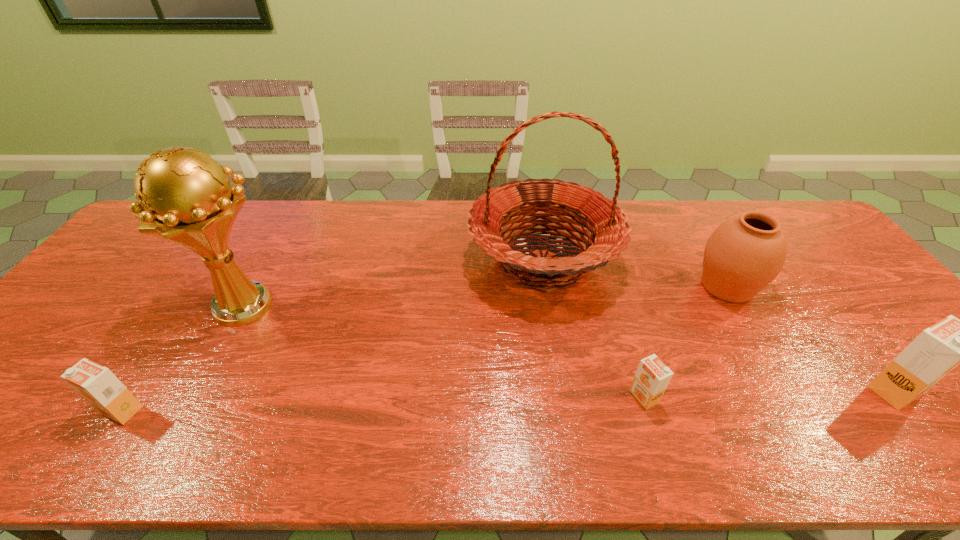
Find the location of a particular element. free point that satisfies the following two spatial constraints: 1. at the front of the second orange juice from right to left where the globe is prominent; 2. on the right side of the trophy_cup is located at coordinates (198, 396).

I want to click on free space that satisfies the following two spatial constraints: 1. on the front side of the urn; 2. on the right side of the rightmost orange juice, so click(788, 390).

You are a GUI agent. You are given a task and a screenshot of the screen. Output one action in this format:
    pyautogui.click(x=<x>, y=<y>)
    Task: Click on the vacant space that satisfies the following two spatial constraints: 1. at the front of the trophy_cup where the globe is prominent; 2. on the right side of the rightmost object
    This screenshot has height=540, width=960.
    Given the screenshot: What is the action you would take?
    pyautogui.click(x=201, y=390)